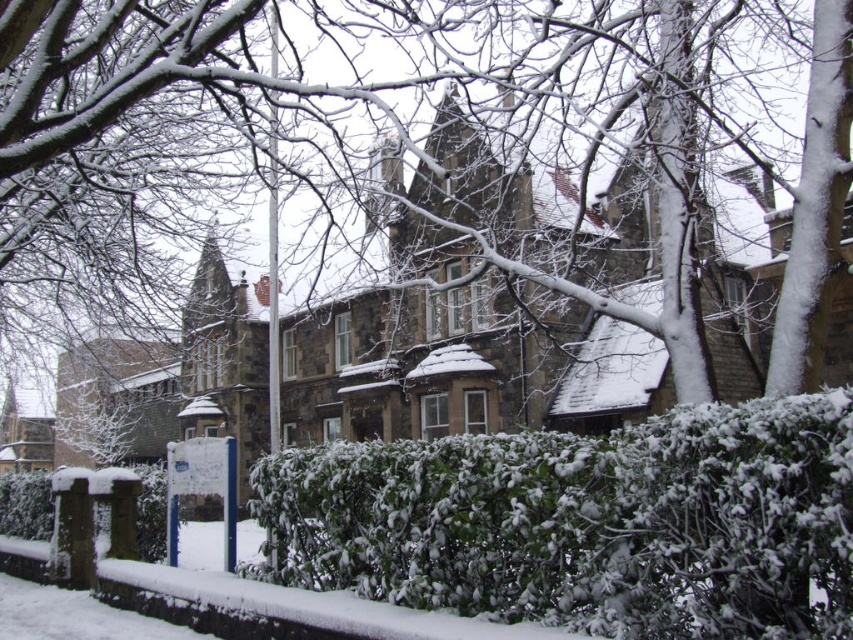
Does snow-covered tree at upper center appear on the right side of green leafy bush at center?

Incorrect, snow-covered tree at upper center is not on the right side of green leafy bush at center.

Is point (286, 116) positioned in front of point (729, 493)?

No, it is behind (729, 493).

Find the location of a particular element. This screenshot has height=640, width=853. snow-covered tree at upper center is located at coordinates (473, 116).